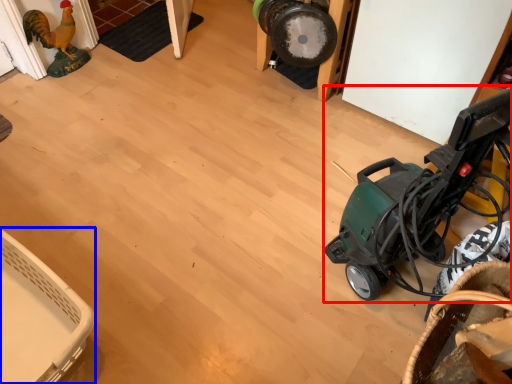
Question: Which object appears farthest to the camera in this image, baby carriage (highlighted by a red box) or basket (highlighted by a blue box)?

Choices:
 (A) baby carriage
 (B) basket

Answer: (B)